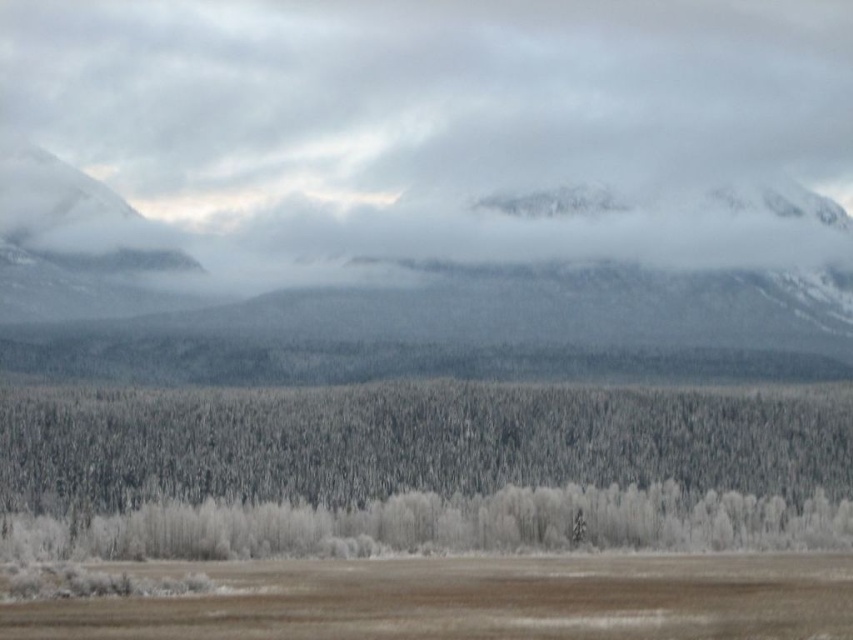
Does white fluffy cloud at upper center have a larger size compared to brown matte grassland at lower center?

Indeed, white fluffy cloud at upper center has a larger size compared to brown matte grassland at lower center.

Which is below, white fluffy cloud at upper center or brown matte grassland at lower center?

brown matte grassland at lower center

Which is in front, point (53, 13) or point (320, 566)?

Point (320, 566)

The height and width of the screenshot is (640, 853). Identify the location of white fluffy cloud at upper center. (445, 120).

Who is positioned more to the right, snowy rock mountain at upper center or brown matte grassland at lower center?

Positioned to the right is brown matte grassland at lower center.

Measure the distance between snowy rock mountain at upper center and brown matte grassland at lower center.

snowy rock mountain at upper center and brown matte grassland at lower center are 271.53 meters apart from each other.

The height and width of the screenshot is (640, 853). I want to click on snowy rock mountain at upper center, so coord(376,289).

Where is `snowy rock mountain at upper center`? This screenshot has height=640, width=853. snowy rock mountain at upper center is located at coordinates (376, 289).

Who is shorter, white fluffy cloud at upper center or snow-covered trees at center?

With less height is snow-covered trees at center.

I want to click on white fluffy cloud at upper center, so click(445, 120).

I want to click on white fluffy cloud at upper center, so click(x=445, y=120).